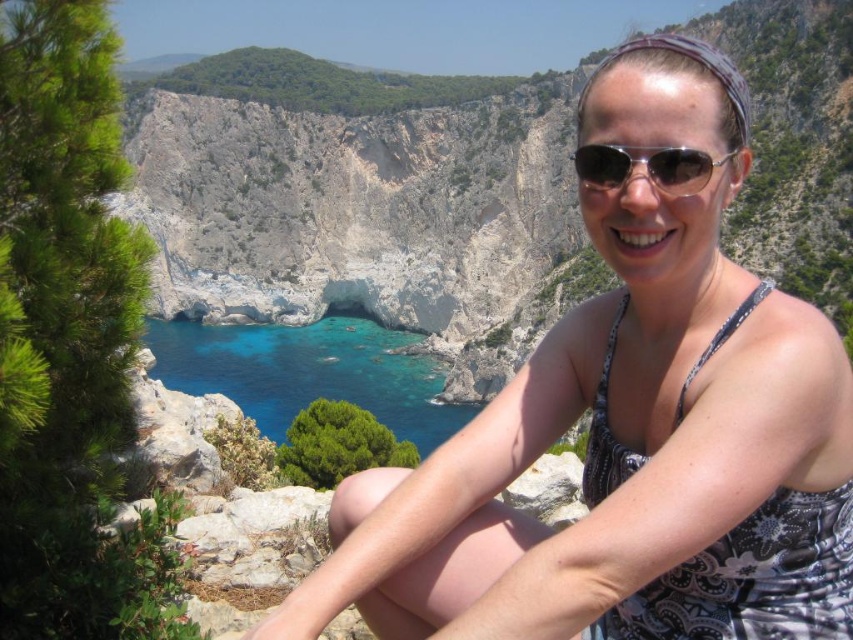
Question: Considering the relative positions of white printed dress at center and blue crystal water at center in the image provided, where is white printed dress at center located with respect to blue crystal water at center?

Choices:
 (A) below
 (B) above

Answer: (B)

Question: Is white printed dress at center positioned before sunglasses at center?

Choices:
 (A) no
 (B) yes

Answer: (B)

Question: Which object is positioned closest to the sunglasses at center?

Choices:
 (A) white printed dress at center
 (B) blue crystal water at center

Answer: (A)

Question: Based on their relative distances, which object is nearer to the white printed dress at center?

Choices:
 (A) blue crystal water at center
 (B) sunglasses at center

Answer: (B)

Question: Which point is farther from the camera taking this photo?

Choices:
 (A) (585, 308)
 (B) (692, 170)
 (C) (254, 417)

Answer: (C)

Question: Does blue crystal water at center have a larger size compared to sunglasses at center?

Choices:
 (A) no
 (B) yes

Answer: (B)